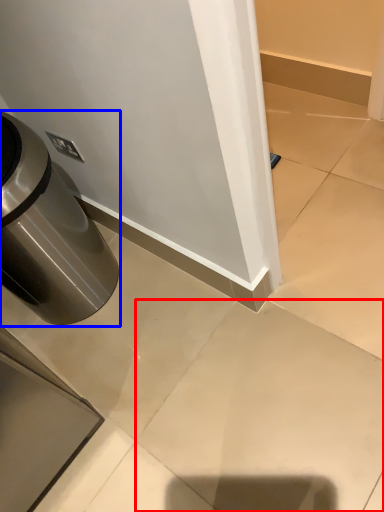
Question: Which point is further to the camera, concrete (highlighted by a red box) or waste container (highlighted by a blue box)?

Choices:
 (A) concrete
 (B) waste container

Answer: (B)